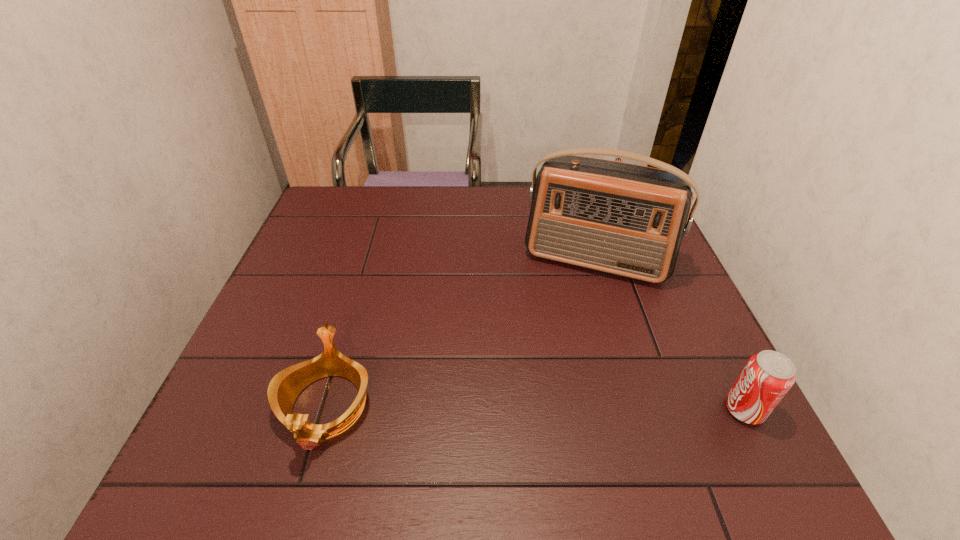
Identify the location of puncher that is positioned at the right edge. (617, 159).

At what (x,y) coordinates should I click in order to perform the action: click on object that is positioned at the near left corner. Please return your answer as a coordinate pair (x, y). The image size is (960, 540). Looking at the image, I should click on (284, 388).

Locate an element on the screen. The height and width of the screenshot is (540, 960). object at the far right corner is located at coordinates (617, 159).

Where is `object situated at the near right corner`? Image resolution: width=960 pixels, height=540 pixels. object situated at the near right corner is located at coordinates (767, 376).

Find the location of a particular element. vacant region at the far edge of the desktop is located at coordinates (486, 217).

Locate an element on the screen. Image resolution: width=960 pixels, height=540 pixels. free space at the left edge of the desktop is located at coordinates (325, 252).

I want to click on blank area at the far left corner, so click(367, 198).

This screenshot has height=540, width=960. In the image, there is a desktop. What are the coordinates of `free region at the near left corner` in the screenshot? It's located at (222, 410).

At what (x,y) coordinates should I click in order to perform the action: click on vacant region at the near right corner of the desktop. Please return your answer as a coordinate pair (x, y). Image resolution: width=960 pixels, height=540 pixels. Looking at the image, I should click on (671, 423).

Find the location of `unoccupied area between the tiara and the farthest object`. unoccupied area between the tiara and the farthest object is located at coordinates (468, 302).